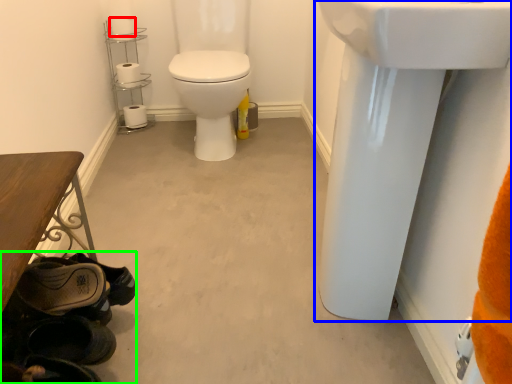
Question: Which is farther away from toilet paper (highlighted by a red box)? sink (highlighted by a blue box) or shoe (highlighted by a green box)?

Choices:
 (A) sink
 (B) shoe

Answer: (A)